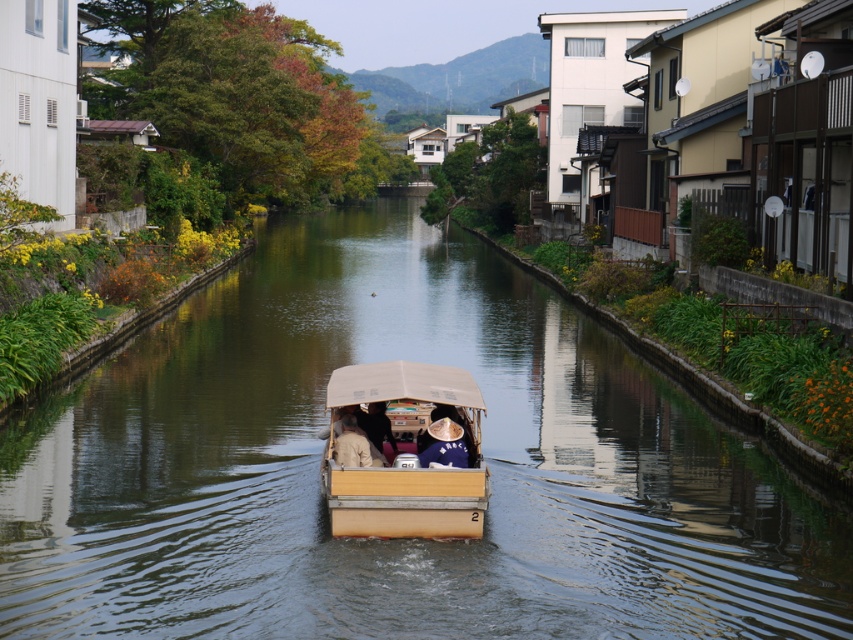
You are standing on the bank of the canal and want to place a small floating decoration between the light brown fabric hat at center and the light brown wooden boat at center. Can you fit it there?

The distance between the light brown fabric hat at center and the light brown wooden boat at center is 48.86 centimeters, so the small floating decoration can be placed there as there is enough space.

You are standing on the bank of the canal and want to place both the light brown fabric hat at center and the light brown wooden boat at center onto a shelf. The shelf has a width of 1 meter. Which object will fit better on the shelf based on their widths?

The light brown fabric hat at center has a smaller width than the light brown wooden boat at center. Since the shelf is 1 meter wide, the light brown fabric hat at center will fit better on the shelf compared to the boat.